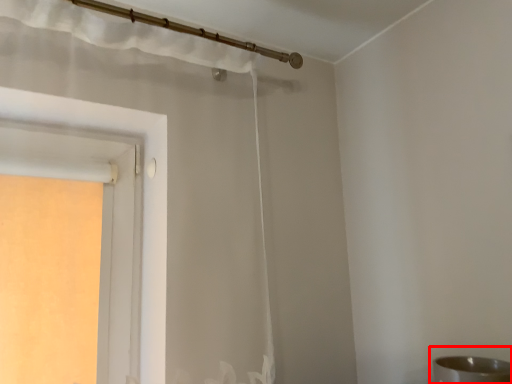
Question: Where is sink (annotated by the red box) located in relation to curtain in the image?

Choices:
 (A) right
 (B) left

Answer: (A)